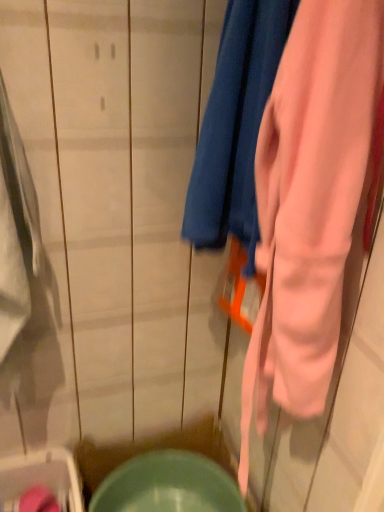
Describe the element at coordinates (168, 485) in the screenshot. The image size is (384, 512). I see `matte green bowl at lower center` at that location.

You are a GUI agent. You are given a task and a screenshot of the screen. Output one action in this format:
    pyautogui.click(x=<x>, y=<y>)
    Task: Click on the matte green plastic washer at lower left
    The height and width of the screenshot is (512, 384).
    Given the screenshot: What is the action you would take?
    pos(40,481)

Locate an element on the screen. pink soft fabric towel at center is located at coordinates (235, 126).

Is matte green bowl at lower center outside of pink soft fabric towel at center?

matte green bowl at lower center lies outside pink soft fabric towel at center's area.

Considering the points (227, 506) and (251, 111), which point is behind, point (227, 506) or point (251, 111)?

The point (227, 506) is farther from the camera.

Can you confirm if matte green bowl at lower center is smaller than pink soft fabric towel at center?

Indeed, matte green bowl at lower center has a smaller size compared to pink soft fabric towel at center.

Is matte green bowl at lower center touching pink soft fabric towel at center?

No.

Where is `washer that is above the matte green bowl at lower center (from a real-world perspective)`? washer that is above the matte green bowl at lower center (from a real-world perspective) is located at coordinates (40, 481).

Is matte green plastic washer at lower left facing towards matte green bowl at lower center?

No, matte green plastic washer at lower left is not oriented towards matte green bowl at lower center.

Are matte green plastic washer at lower left and matte green bowl at lower center located far from each other?

No, matte green plastic washer at lower left is in close proximity to matte green bowl at lower center.

Can you confirm if matte green plastic washer at lower left is thinner than matte green bowl at lower center?

Yes.

How far apart are matte green plastic washer at lower left and pink soft fabric towel at center?

matte green plastic washer at lower left is 36.30 inches away from pink soft fabric towel at center.

Is matte green plastic washer at lower left to the right of pink soft fabric towel at center from the viewer's perspective?

No.

At what (x,y) coordinates should I click in order to perform the action: click on washer below the pink soft fabric towel at center (from a real-world perspective). Please return your answer as a coordinate pair (x, y). The image size is (384, 512). Looking at the image, I should click on (40, 481).

What's the angular difference between matte green plastic washer at lower left and pink soft fabric towel at center's facing directions?

The angle between the facing direction of matte green plastic washer at lower left and the facing direction of pink soft fabric towel at center is 119 degrees.

From the image's perspective, is pink soft fabric towel at center below matte green bowl at lower center?

No, from the image's perspective, pink soft fabric towel at center is not beneath matte green bowl at lower center.

Is point (195, 205) behind point (167, 453)?

No, (195, 205) is in front of (167, 453).

In the image, is pink soft fabric towel at center positioned in front of or behind matte green bowl at lower center?

Visually, pink soft fabric towel at center is located in front of matte green bowl at lower center.

From a real-world perspective, is pink soft fabric towel at center below matte green bowl at lower center?

No, from a real-world perspective, pink soft fabric towel at center is not beneath matte green bowl at lower center.

From the image's perspective, would you say matte green bowl at lower center is positioned over matte green plastic washer at lower left?

Incorrect, from the image's perspective, matte green bowl at lower center is lower than matte green plastic washer at lower left.

Which object is positioned more to the right, matte green bowl at lower center or matte green plastic washer at lower left?

From the viewer's perspective, matte green bowl at lower center appears more on the right side.

Can you confirm if matte green bowl at lower center is bigger than matte green plastic washer at lower left?

Yes, matte green bowl at lower center is bigger than matte green plastic washer at lower left.

Which is in front, point (93, 496) or point (53, 456)?

The point (53, 456) is in front.

Based on the photo, is pink soft fabric towel at center wider or thinner than matte green plastic washer at lower left?

Considering their sizes, pink soft fabric towel at center looks slimmer than matte green plastic washer at lower left.

Does point (188, 234) come in front of point (62, 490)?

Yes, point (188, 234) is closer to viewer.

Between pink soft fabric towel at center and matte green plastic washer at lower left, which one is positioned in front?

Positioned in front is pink soft fabric towel at center.

From the image's perspective, is pink soft fabric towel at center beneath matte green plastic washer at lower left?

No, from the image's perspective, pink soft fabric towel at center is not below matte green plastic washer at lower left.

Identify the location of towel that appears above the matte green bowl at lower center (from a real-world perspective). (235, 126).

This screenshot has width=384, height=512. I want to click on washer on the left of matte green bowl at lower center, so click(40, 481).

Considering their positions, is matte green plastic washer at lower left positioned further to matte green bowl at lower center than pink soft fabric towel at center?

Among the two, pink soft fabric towel at center is located further to matte green bowl at lower center.

Looking at the image, which one is located further to pink soft fabric towel at center, matte green bowl at lower center or matte green plastic washer at lower left?

The object further to pink soft fabric towel at center is matte green plastic washer at lower left.

Looking at the image, which one is located further to matte green bowl at lower center, pink soft fabric towel at center or matte green plastic washer at lower left?

Among the two, pink soft fabric towel at center is located further to matte green bowl at lower center.

Considering their positions, is matte green bowl at lower center positioned further to matte green plastic washer at lower left than pink soft fabric towel at center?

Based on the image, pink soft fabric towel at center appears to be further to matte green plastic washer at lower left.

Which object lies further to the anchor point matte green plastic washer at lower left, pink soft fabric towel at center or matte green bowl at lower center?

Among the two, pink soft fabric towel at center is located further to matte green plastic washer at lower left.

From the image, which object appears to be farther from pink soft fabric towel at center, matte green plastic washer at lower left or matte green bowl at lower center?

matte green plastic washer at lower left.

Image resolution: width=384 pixels, height=512 pixels. In order to click on washer between pink soft fabric towel at center and matte green bowl at lower center from top to bottom in this screenshot , I will do `click(40, 481)`.